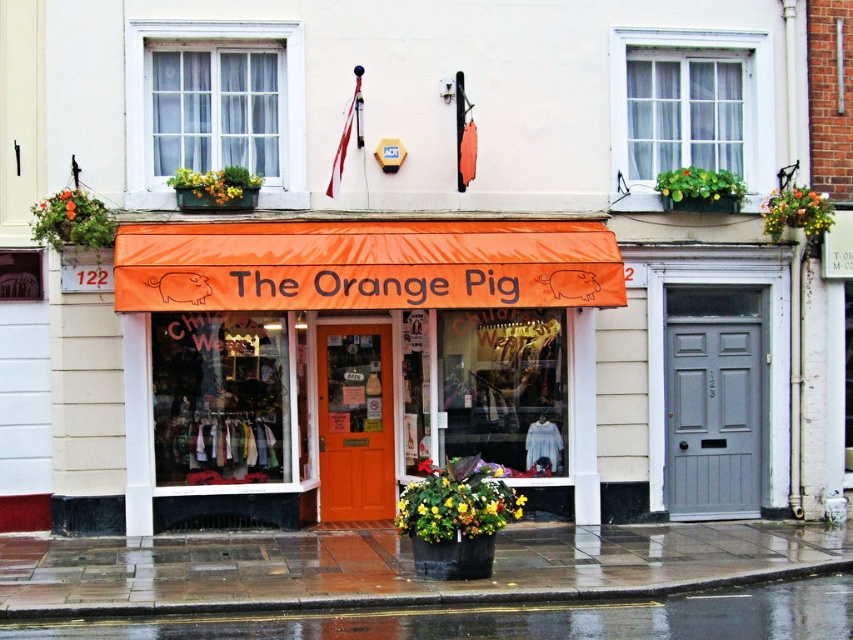
You are a customer standing in front of the shop entrance. You want to look through the white glass window at upper center to see the items inside. Can you see the orange fabric awning at center blocking your view of the window?

The orange fabric awning at center is in front of the white glass window at upper center, so yes, the awning is blocking the view of the window.

You are a delivery person standing on the wet asphalt at lower left, and you need to deliver a package to the white glass window at upper center. The delivery robot you are using has a maximum range of 5 meters. Can the robot reach the window from your current position?

The distance between wet asphalt at lower left and white glass window at upper center is 5.51 meters, which exceeds the robot maximum range of 5 meters. The robot cannot reach the window.